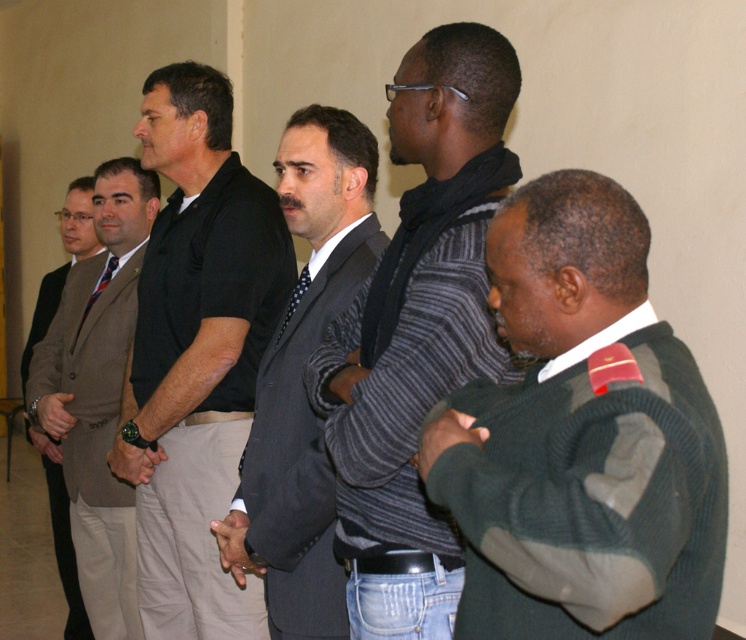
Can you confirm if brown woolen suit at left is thinner than striped fabric tie at center?

In fact, brown woolen suit at left might be wider than striped fabric tie at center.

Is brown woolen suit at left positioned before striped fabric tie at center?

No, brown woolen suit at left is behind striped fabric tie at center.

What do you see at coordinates (65, 552) in the screenshot? Image resolution: width=746 pixels, height=640 pixels. I see `brown woolen suit at left` at bounding box center [65, 552].

Where is `brown woolen suit at left`? Image resolution: width=746 pixels, height=640 pixels. brown woolen suit at left is located at coordinates (65, 552).

Does black matte shirt at center come behind black dotted tie at center?

Yes, black matte shirt at center is behind black dotted tie at center.

Measure the distance between point (160, 346) and camera.

Point (160, 346) is 2.74 meters from camera.

Between point (157, 548) and point (304, 269), which one is positioned behind?

Positioned behind is point (157, 548).

Where is `black matte shirt at center`? The height and width of the screenshot is (640, 746). black matte shirt at center is located at coordinates (195, 353).

Is dark gray suit at center thinner than light brown suit at left?

Correct, dark gray suit at center's width is less than light brown suit at left's.

Who is shorter, dark gray suit at center or light brown suit at left?

Standing shorter between the two is dark gray suit at center.

Who is more distant from viewer, (238, 515) or (66, 284)?

Point (66, 284)

This screenshot has width=746, height=640. Identify the location of dark gray suit at center. (301, 381).